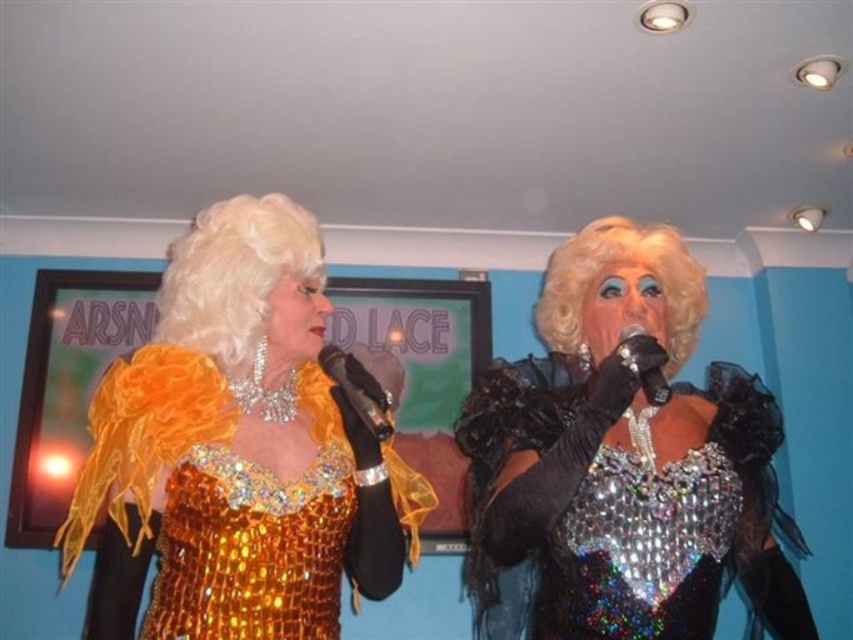
You are a photographer at the event and want to capture a photo where both the shiny blonde wig at upper left and the metallic silver microphone at center are clearly visible. Based on their positions, will the microphone be visible without being blocked by the wig?

The metallic silver microphone at center is behind the shiny blonde wig at upper left, so it might be partially or fully blocked by the wig, making it less visible in the photo.

You are a photographer setting up for a drag performance. You need to ensure the shiny gold dress at left is visible in the frame. Since the metallic silver microphone at center might block the view, can you confirm if the dress is larger than the microphone?

The shiny gold dress at left has a larger size compared to metallic silver microphone at center, so yes, the dress is larger and less likely to be blocked by the microphone.